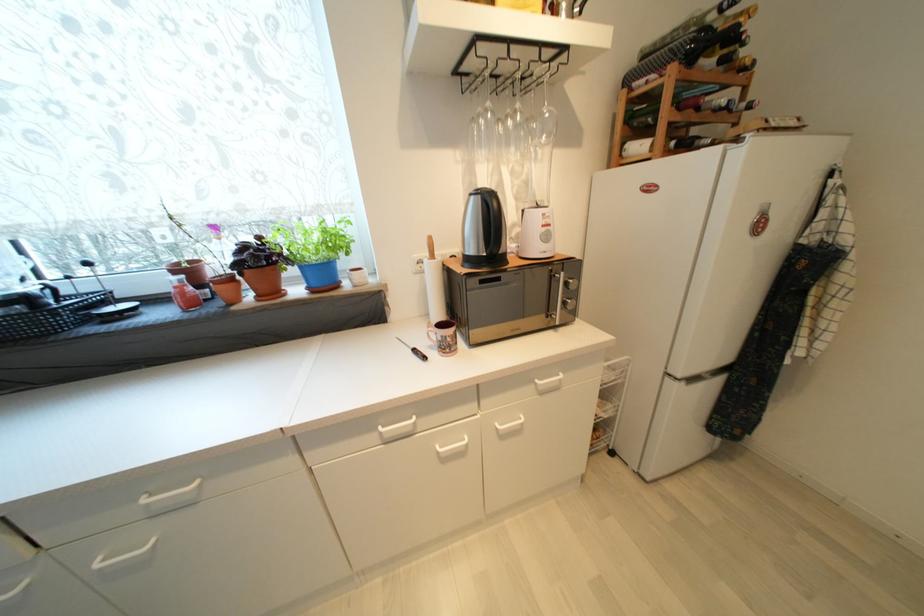
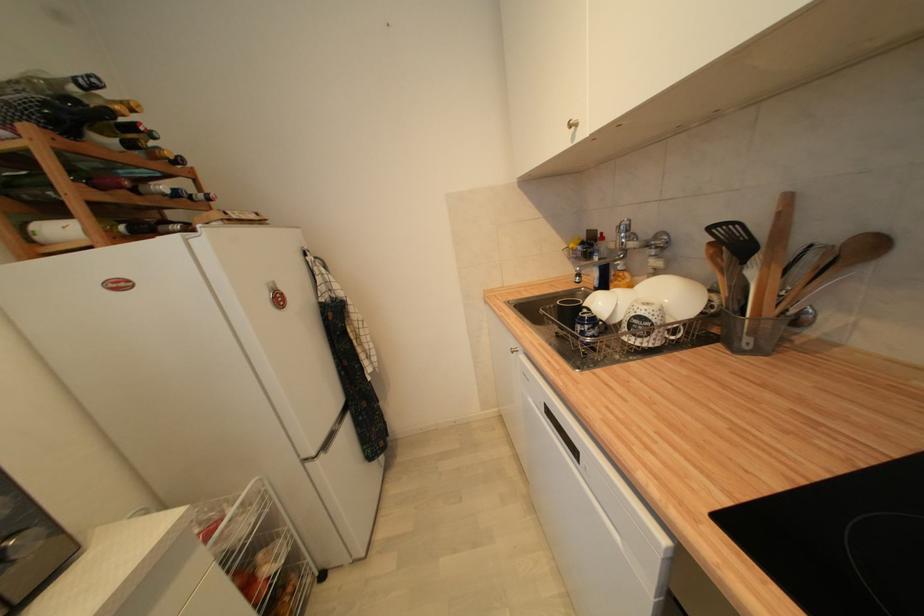
The point at (684, 378) is marked in the first image. Where is the corresponding point in the second image?

(319, 456)